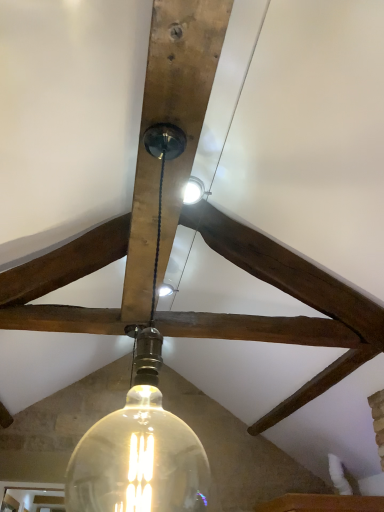
Question: Could translucent glass light bulb at center be considered to be inside clear glass bulb at center?

Choices:
 (A) yes
 (B) no

Answer: (B)

Question: Is clear glass bulb at center in front of translucent glass light bulb at center?

Choices:
 (A) no
 (B) yes

Answer: (B)

Question: Does clear glass bulb at center have a lesser height compared to translucent glass light bulb at center?

Choices:
 (A) yes
 (B) no

Answer: (B)

Question: Is clear glass bulb at center facing towards translucent glass light bulb at center?

Choices:
 (A) no
 (B) yes

Answer: (B)

Question: From a real-world perspective, is clear glass bulb at center on top of translucent glass light bulb at center?

Choices:
 (A) yes
 (B) no

Answer: (B)

Question: Does clear glass bulb at center have a greater height compared to translucent glass light bulb at center?

Choices:
 (A) no
 (B) yes

Answer: (B)

Question: Can you confirm if translucent glass light bulb at center is wider than clear glass bulb at center?

Choices:
 (A) no
 (B) yes

Answer: (A)

Question: Could you tell me if translucent glass light bulb at center is turned towards clear glass bulb at center?

Choices:
 (A) no
 (B) yes

Answer: (A)

Question: Is translucent glass light bulb at center in contact with clear glass bulb at center?

Choices:
 (A) no
 (B) yes

Answer: (B)

Question: From the image's perspective, does translucent glass light bulb at center appear lower than clear glass bulb at center?

Choices:
 (A) no
 (B) yes

Answer: (B)

Question: Is translucent glass light bulb at center at the right side of clear glass bulb at center?

Choices:
 (A) yes
 (B) no

Answer: (B)

Question: Is translucent glass light bulb at center oriented away from clear glass bulb at center?

Choices:
 (A) yes
 (B) no

Answer: (A)

Question: From the image's perspective, is clear glass bulb at center above or below translucent glass light bulb at center?

Choices:
 (A) above
 (B) below

Answer: (A)